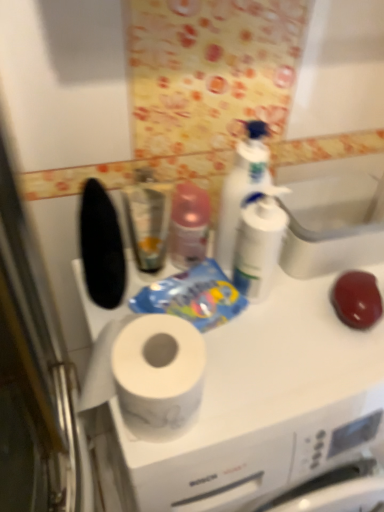
Question: Is white glossy bottle at upper center surrounded by white glossy sink at upper center?

Choices:
 (A) no
 (B) yes

Answer: (A)

Question: From the image's perspective, would you say white glossy sink at upper center is positioned over white glossy bottle at upper center?

Choices:
 (A) no
 (B) yes

Answer: (A)

Question: Considering the relative sizes of white glossy sink at upper center and white glossy bottle at upper center in the image provided, is white glossy sink at upper center bigger than white glossy bottle at upper center?

Choices:
 (A) no
 (B) yes

Answer: (B)

Question: Considering the relative sizes of white glossy sink at upper center and white glossy bottle at upper center in the image provided, is white glossy sink at upper center shorter than white glossy bottle at upper center?

Choices:
 (A) yes
 (B) no

Answer: (A)

Question: Does white glossy sink at upper center lie in front of white glossy bottle at upper center?

Choices:
 (A) no
 (B) yes

Answer: (A)

Question: From the image's perspective, is white glossy sink at upper center under white glossy bottle at upper center?

Choices:
 (A) yes
 (B) no

Answer: (A)

Question: Does white glossy bottle at upper center have a lesser width compared to metallic silver mouthwash at center?

Choices:
 (A) no
 (B) yes

Answer: (B)

Question: Is white glossy bottle at upper center behind metallic silver mouthwash at center?

Choices:
 (A) no
 (B) yes

Answer: (A)

Question: Can metallic silver mouthwash at center be found inside white glossy bottle at upper center?

Choices:
 (A) yes
 (B) no

Answer: (B)

Question: Is white glossy bottle at upper center closer to the viewer compared to metallic silver mouthwash at center?

Choices:
 (A) no
 (B) yes

Answer: (B)

Question: Can you confirm if white glossy bottle at upper center is positioned to the right of metallic silver mouthwash at center?

Choices:
 (A) no
 (B) yes

Answer: (B)

Question: From a real-world perspective, is white glossy bottle at upper center physically below metallic silver mouthwash at center?

Choices:
 (A) yes
 (B) no

Answer: (B)

Question: From the image's perspective, is white glossy bottle at upper center above white matte countertop at center?

Choices:
 (A) no
 (B) yes

Answer: (B)